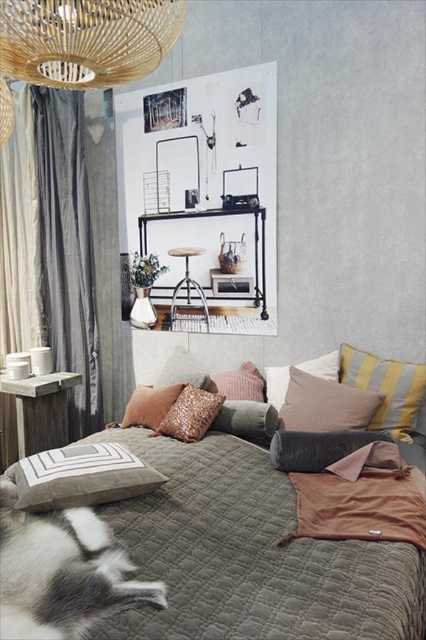
Does striped fabric pillow at center appear on the left side of shiny gold pillow at center?

No, striped fabric pillow at center is not to the left of shiny gold pillow at center.

Does striped fabric pillow at center come in front of shiny gold pillow at center?

Yes, striped fabric pillow at center is in front of shiny gold pillow at center.

The width and height of the screenshot is (426, 640). What are the coordinates of `striped fabric pillow at center` in the screenshot? It's located at (x=385, y=388).

Does white soft pillow at center have a lesser width compared to textured cream pillow at center?

No.

Identify the location of white soft pillow at center. (276, 385).

Where is `white soft pillow at center`? white soft pillow at center is located at coordinates (276, 385).

Image resolution: width=426 pixels, height=640 pixels. In order to click on white soft pillow at center in this screenshot , I will do `click(276, 385)`.

Is point (363, 362) farther from viewer compared to point (299, 422)?

Yes.

Does striped fabric pillow at center come in front of matte brown pillow at center?

No, striped fabric pillow at center is further to the viewer.

The image size is (426, 640). Identify the location of striped fabric pillow at center. (385, 388).